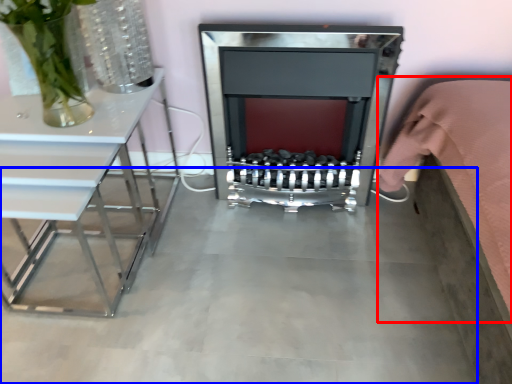
Question: Which of the following is the farthest to the observer, bed (highlighted by a red box) or concrete (highlighted by a blue box)?

Choices:
 (A) bed
 (B) concrete

Answer: (B)